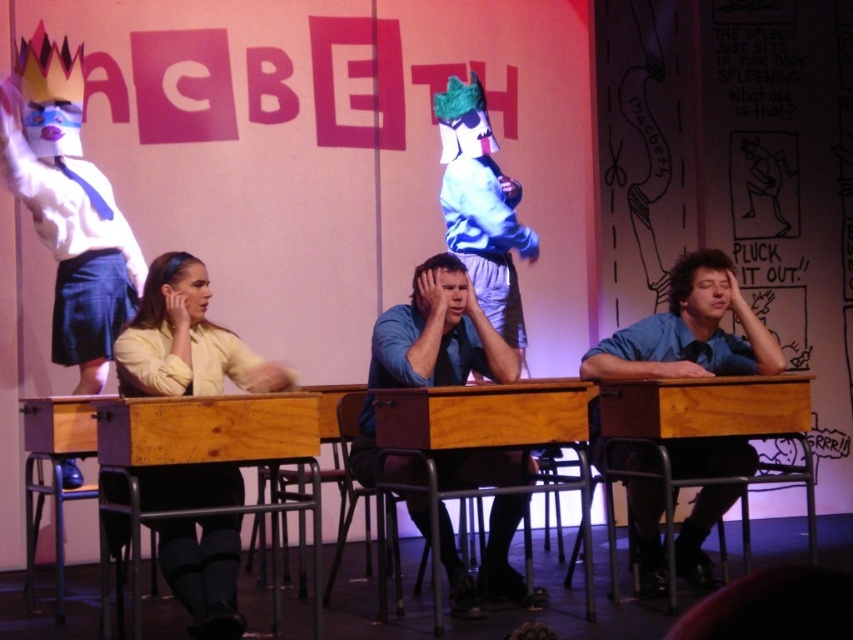
You are an audience member sitting in the front row of the MACBETH play. You notice two actors wearing yellow shirt at center and blue shirt at center. Which actor is positioned more to your left side?

The yellow shirt at center is positioned to the left of blue shirt at center, so the actor in the yellow shirt at center is more to your left side.

You are an audience member sitting in the front row of the MACBETH play. You notice two actors wearing yellow shirt at center and blue shirt at center. Which actor is sitting higher up?

The yellow shirt at center is above the blue shirt at center, so the actor wearing the yellow shirt at center is sitting higher up.

You are an audience member sitting in the front row of the MACBETH play. You notice two points on the stage marked as point 1 at coordinates point (248, 356) and point 2 at coordinates point (408, 385). Which point is closer to you?

Point (248, 356) is closer to the viewer than point (408, 385).